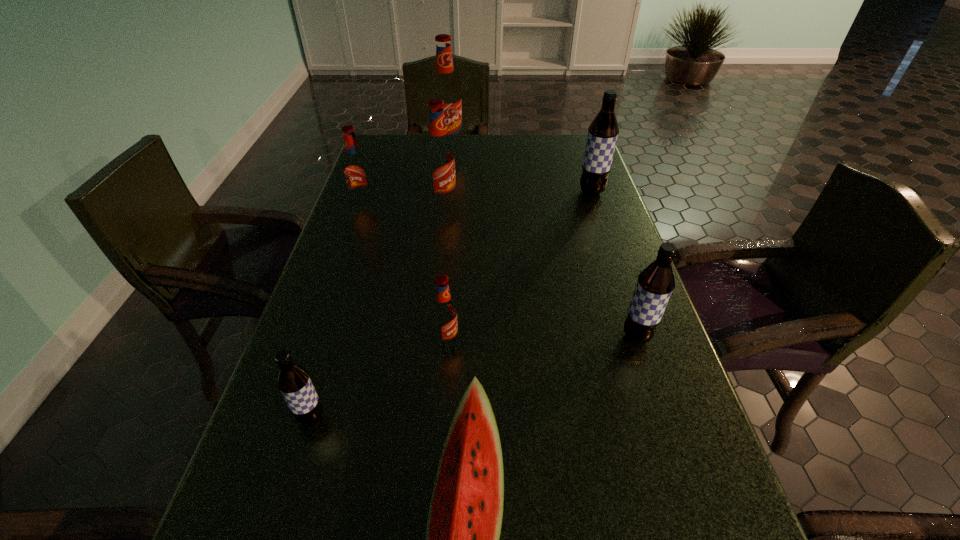
Where is `free spot located on the back of the second biggest red root beer`? The height and width of the screenshot is (540, 960). free spot located on the back of the second biggest red root beer is located at coordinates (449, 146).

The image size is (960, 540). What are the coordinates of `vacant area situated on the front of the biggest brown root beer` in the screenshot? It's located at (612, 249).

Identify the location of free space located on the right of the leftmost red root beer. The width and height of the screenshot is (960, 540). (475, 206).

Where is `free spot located 0.170m on the back of the second nearest brown root beer`? The image size is (960, 540). free spot located 0.170m on the back of the second nearest brown root beer is located at coordinates (615, 271).

Find the location of a particular element. The image size is (960, 540). vacant region located 0.060m on the front of the nearest red root beer is located at coordinates (444, 376).

You are a GUI agent. You are given a task and a screenshot of the screen. Output one action in this format:
    pyautogui.click(x=<x>, y=<y>)
    Task: Click on the free space located on the back of the nearest brown root beer
    The width and height of the screenshot is (960, 540).
    Given the screenshot: What is the action you would take?
    pyautogui.click(x=353, y=281)

Identify the location of object that is at the far edge. coord(445,87).

Find the location of `free space at the far edge`. free space at the far edge is located at coordinates (475, 162).

Where is `free space at the left edge of the desktop`? free space at the left edge of the desktop is located at coordinates (388, 210).

Identify the location of vacant space at the right edge of the desktop. (577, 264).